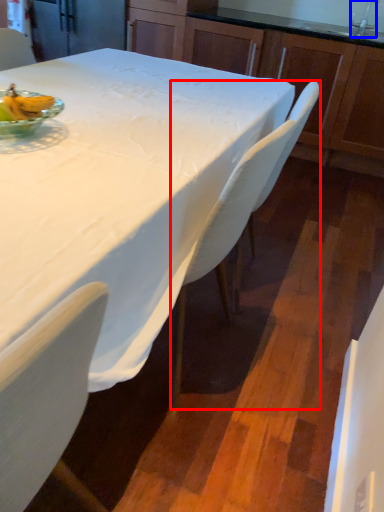
Question: Which object appears closest to the camera in this image, chair (highlighted by a red box) or faucet (highlighted by a blue box)?

Choices:
 (A) chair
 (B) faucet

Answer: (A)